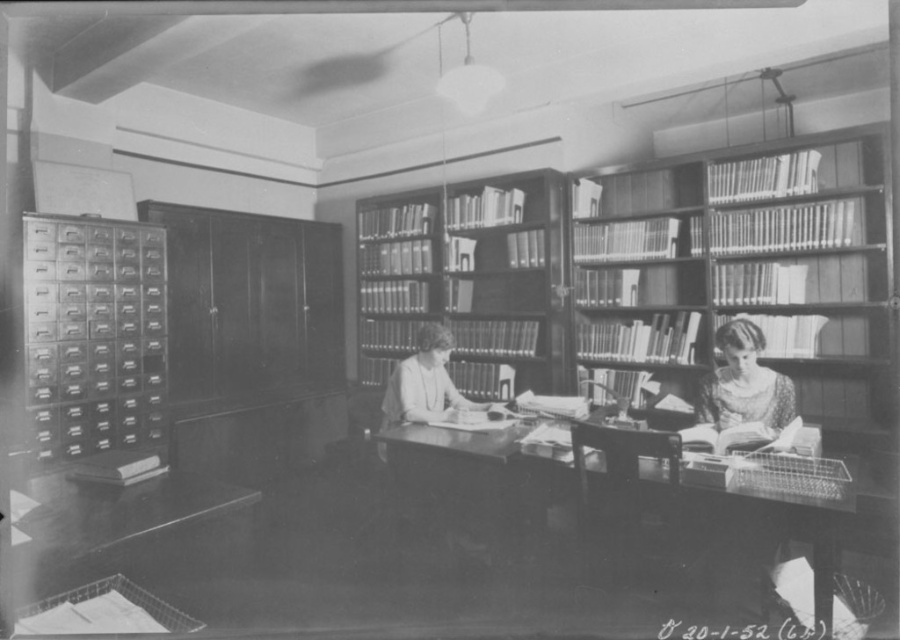
Is wooden desk at center further to the viewer compared to wooden bookcase at center?

No.

Is point (597, 445) behind point (397, 314)?

No.

Looking at this image, measure the distance between point (621, 493) and camera.

They are 2.74 meters apart.

In order to click on wooden desk at center in this screenshot , I will do `click(628, 516)`.

Between wooden bookcase at center and smooth skin face at lower right, which one appears on the right side from the viewer's perspective?

smooth skin face at lower right

Does wooden bookcase at center have a greater width compared to smooth skin face at lower right?

Yes, wooden bookcase at center is wider than smooth skin face at lower right.

Is point (392, 243) less distant than point (727, 397)?

No, it is not.

Locate an element on the screen. The height and width of the screenshot is (640, 900). wooden bookcase at center is located at coordinates (471, 280).

Which is behind, point (761, 488) or point (749, 401)?

The point (749, 401) is more distant.

Can you confirm if wooden desk at center is taller than smooth skin face at lower right?

Indeed, wooden desk at center has a greater height compared to smooth skin face at lower right.

Image resolution: width=900 pixels, height=640 pixels. I want to click on wooden desk at center, so click(x=628, y=516).